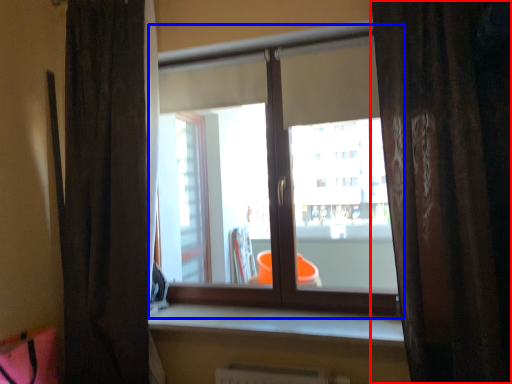
Question: Among these objects, which one is nearest to the camera, curtain (highlighted by a red box) or window (highlighted by a blue box)?

Choices:
 (A) curtain
 (B) window

Answer: (A)